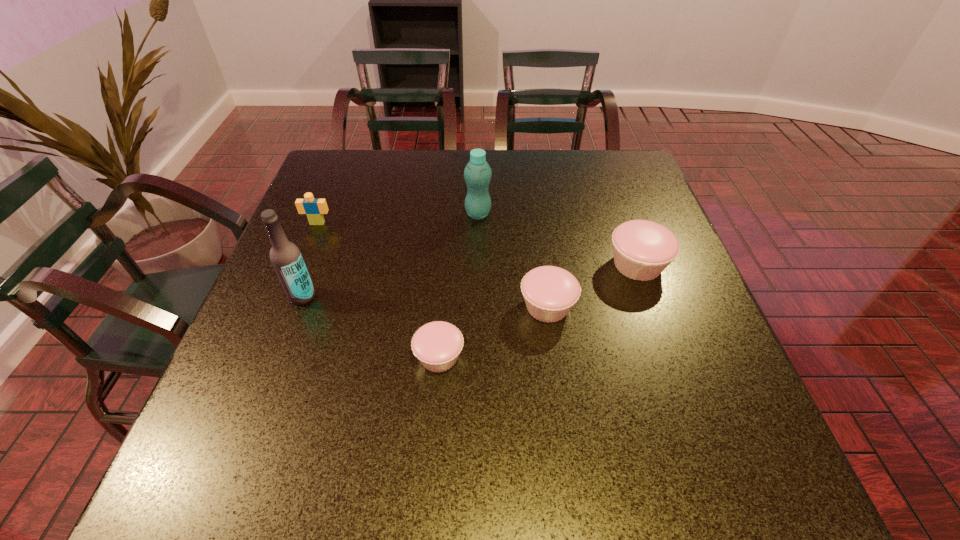
Locate an element on the screen. This screenshot has height=540, width=960. blank area located on the back of the second cupcake from right to left is located at coordinates click(x=534, y=205).

The height and width of the screenshot is (540, 960). In order to click on vacant area situated 0.300m on the front of the rightmost object in this screenshot , I will do `click(689, 411)`.

Image resolution: width=960 pixels, height=540 pixels. In order to click on blank area located on the face of the Lego in this screenshot , I will do `click(287, 298)`.

Where is `blank space located on the label of the tallest object`? Image resolution: width=960 pixels, height=540 pixels. blank space located on the label of the tallest object is located at coordinates (292, 324).

At what (x,y) coordinates should I click in order to perform the action: click on vacant space located 0.080m at the front cap of the water bottle. Please return your answer as a coordinate pair (x, y). The image size is (960, 540). Looking at the image, I should click on pos(521,214).

At what (x,y) coordinates should I click in order to perform the action: click on Lego that is at the left edge. Please return your answer as a coordinate pair (x, y). Looking at the image, I should click on point(314,209).

Find the location of `beer bottle that is at the left edge`. beer bottle that is at the left edge is located at coordinates (285, 256).

Locate an element on the screen. object present at the right edge is located at coordinates (642, 249).

Where is `blank area at the far edge`? blank area at the far edge is located at coordinates pyautogui.click(x=407, y=179).

This screenshot has width=960, height=540. Find the location of `free space at the near edge of the desktop`. free space at the near edge of the desktop is located at coordinates (397, 411).